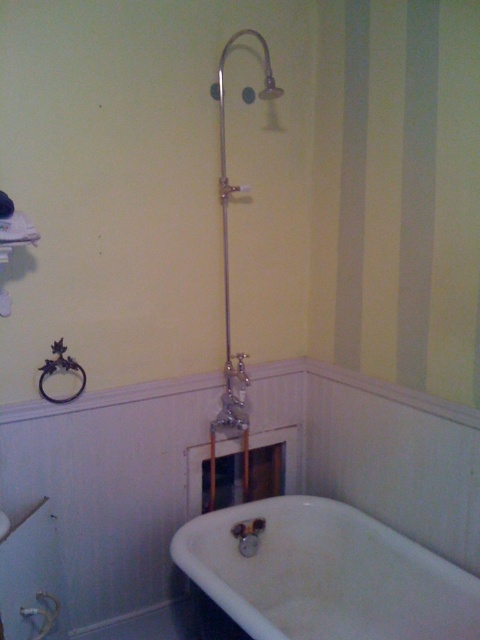
From the picture: You are standing in the bathroom and want to reach both the white glossy bathtub at lower center and the polished chrome shower at center. Which object will you encounter first as you move forward?

You will encounter the white glossy bathtub at lower center first because it is closer to you than the polished chrome shower at center.

You are a plumber trying to install a new faucet. You need to know which object is shorter between the white glossy bathtub at lower center and the polished chrome shower at center. Which one is shorter?

The white glossy bathtub at lower center is shorter than the polished chrome shower at center.

You are a plumber trying to fix a leak in the bathroom. You need to access the pipes under the white glossy bathtub at lower center and the polished chrome shower at center. Based on their positions, which object should you move first to reach the pipes underneath?

The white glossy bathtub at lower center is positioned on the right side of the polished chrome shower at center. Since the bathtub is to the right of the shower, you should move the polished chrome shower at center first to access the pipes underneath the white glossy bathtub at lower center.